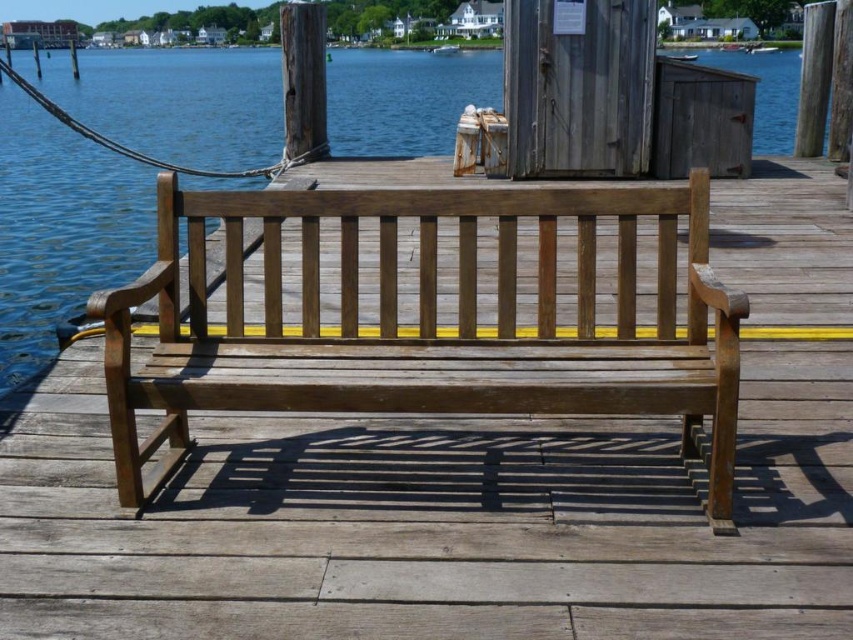
Between matte wood bench at center and transparent blue water at center, which one appears on the right side from the viewer's perspective?

From the viewer's perspective, matte wood bench at center appears more on the right side.

Between matte wood bench at center and transparent blue water at center, which one has less height?

Standing shorter between the two is matte wood bench at center.

Is point (726, 522) farther from camera compared to point (99, 92)?

No, it is in front of (99, 92).

Where is `matte wood bench at center`? matte wood bench at center is located at coordinates (426, 323).